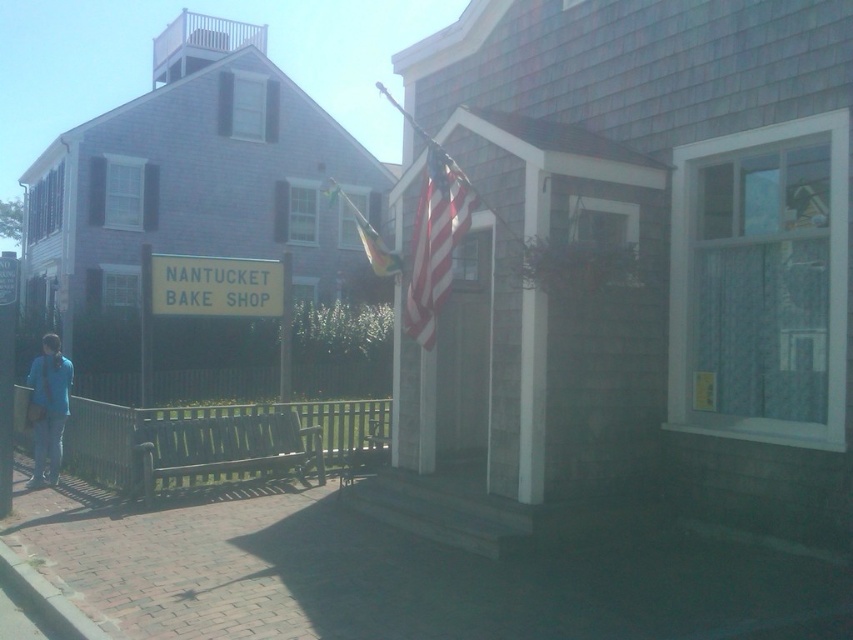
You are standing in front of the Nantucket Bake Shop and want to place a new bench between the brick pavement at lower left and the american flag at center. Which object should the bench be placed closer to if it needs to be near the entrance?

The bench should be placed closer to the american flag at center because it is located at the entrance, while the brick pavement at lower left is farther away from the entrance.

You are standing in front of the Nantucket Bake Shop and want to sit on the wooden bench. Which direction should you walk from the american flag at center to reach the brick pavement at lower left where the bench is located?

The brick pavement at lower left is positioned on the left side of the american flag at center, so you should walk to the left from the american flag at center to reach the brick pavement at lower left where the bench is located.